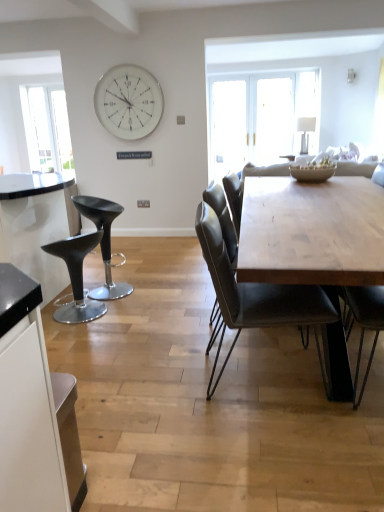
The height and width of the screenshot is (512, 384). What do you see at coordinates (103, 242) in the screenshot? I see `matte black stool at left, arranged as the first stool when viewed from the back` at bounding box center [103, 242].

Identify the location of leather seat at center. This screenshot has height=512, width=384. (254, 296).

Describe the element at coordinates (254, 296) in the screenshot. I see `leather seat at center` at that location.

In order to click on porcelain textured bowl at center in this screenshot , I will do `click(312, 173)`.

Describe the element at coordinates (46, 128) in the screenshot. I see `transparent glass window at left` at that location.

What do you see at coordinates (128, 101) in the screenshot? This screenshot has height=512, width=384. I see `white metallic clock at upper center` at bounding box center [128, 101].

Find the location of a particular element. The height and width of the screenshot is (512, 384). black leather stool at left, the 2th stool when ordered from back to front is located at coordinates (77, 277).

The height and width of the screenshot is (512, 384). I want to click on bowl above the leather seat at center (from a real-world perspective), so click(x=312, y=173).

Looking at this image, considering the sizes of objects porcelain textured bowl at center and leather seat at center in the image provided, who is taller, porcelain textured bowl at center or leather seat at center?

leather seat at center.

Can you tell me how much porcelain textured bowl at center and leather seat at center differ in facing direction?

95.2 degrees separate the facing orientations of porcelain textured bowl at center and leather seat at center.

Is leather seat at center located within porcelain textured bowl at center?

Actually, leather seat at center is outside porcelain textured bowl at center.

Does matte black stool at left, arranged as the first stool when viewed from the back, have a larger size compared to porcelain textured bowl at center?

Yes.

Is matte black stool at left, arranged as the first stool when viewed from the back, not close to porcelain textured bowl at center?

matte black stool at left, arranged as the first stool when viewed from the back, is positioned a significant distance from porcelain textured bowl at center.

Considering the points (96, 227) and (318, 173), which point is behind, point (96, 227) or point (318, 173)?

Positioned behind is point (318, 173).

What's the angular difference between leather seat at center and white metallic clock at upper center's facing directions?

leather seat at center and white metallic clock at upper center are facing 93.2 degrees away from each other.

From a real-world perspective, which object stands above the other?

In real-world perspective, white metallic clock at upper center is above.

Does leather seat at center turn towards white metallic clock at upper center?

No, leather seat at center is not aimed at white metallic clock at upper center.

Considering the sizes of leather seat at center and white metallic clock at upper center in the image, is leather seat at center taller or shorter than white metallic clock at upper center?

leather seat at center is taller than white metallic clock at upper center.

Can we say porcelain textured bowl at center lies outside transparent glass window at left?

That's correct, porcelain textured bowl at center is outside of transparent glass window at left.

Could you tell me if porcelain textured bowl at center is facing transparent glass window at left?

No, porcelain textured bowl at center is not oriented towards transparent glass window at left.

From the image's perspective, which one is positioned higher, porcelain textured bowl at center or transparent glass window at left?

transparent glass window at left is shown above in the image.

Is point (313, 169) positioned behind point (67, 141)?

No, it is not.

Can you confirm if matte black stool at left, which is counted as the 2th stool, starting from the front, is taller than black leather stool at left, the 2th stool when ordered from back to front?

Yes, matte black stool at left, which is counted as the 2th stool, starting from the front, is taller than black leather stool at left, the 2th stool when ordered from back to front.

Are matte black stool at left, arranged as the first stool when viewed from the back, and black leather stool at left, the 2th stool when ordered from back to front, located far from each other?

No, matte black stool at left, arranged as the first stool when viewed from the back, is not far away from black leather stool at left, the 2th stool when ordered from back to front.

Would you say matte black stool at left, which is counted as the 2th stool, starting from the front, is inside or outside black leather stool at left, positioned as the 1th stool in front-to-back order?

matte black stool at left, which is counted as the 2th stool, starting from the front, is spatially situated outside black leather stool at left, positioned as the 1th stool in front-to-back order.

From a real-world perspective, which object stands above the other?

matte black stool at left, arranged as the first stool when viewed from the back.

Considering the relative positions of leather seat at center and white glossy lampshade at upper center in the image provided, is leather seat at center to the left of white glossy lampshade at upper center from the viewer's perspective?

Yes.

Does leather seat at center lie behind white glossy lampshade at upper center?

No.

Where is `chair below the white glossy lampshade at upper center (from a real-world perspective)`? Image resolution: width=384 pixels, height=512 pixels. chair below the white glossy lampshade at upper center (from a real-world perspective) is located at coordinates (254, 296).

Can you tell me how much leather seat at center and white glossy lampshade at upper center differ in facing direction?

leather seat at center and white glossy lampshade at upper center are facing 180 degrees away from each other.

Are black leather stool at left, positioned as the 1th stool in front-to-back order, and white metallic clock at upper center beside each other?

No, black leather stool at left, positioned as the 1th stool in front-to-back order, is not next to white metallic clock at upper center.

Is white metallic clock at upper center inside black leather stool at left, the 2th stool when ordered from back to front?

Actually, white metallic clock at upper center is outside black leather stool at left, the 2th stool when ordered from back to front.

Is point (60, 241) closer or farther from the camera than point (151, 90)?

Point (60, 241) is positioned closer to the camera compared to point (151, 90).

How different are the orientations of black leather stool at left, positioned as the 1th stool in front-to-back order, and white metallic clock at upper center in degrees?

134 degrees.

Where is `chair below the porcelain textured bowl at center (from a real-world perspective)`? chair below the porcelain textured bowl at center (from a real-world perspective) is located at coordinates (254, 296).

From the image's perspective, starting from the porcelain textured bowl at center, which stool is the 1st one below? Please provide its 2D coordinates.

[(103, 242)]

Based on their spatial positions, is matte black stool at left, which is counted as the 2th stool, starting from the front, or leather seat at center closer to black leather stool at left, positioned as the 1th stool in front-to-back order?

Based on the image, matte black stool at left, which is counted as the 2th stool, starting from the front, appears to be nearer to black leather stool at left, positioned as the 1th stool in front-to-back order.

Looking at the image, which one is located further to leather seat at center, white glossy lampshade at upper center or transparent glass window at left?

Among the two, transparent glass window at left is located further to leather seat at center.

From the image, which object appears to be nearer to transparent glass window at left, white metallic clock at upper center or matte black stool at left, arranged as the first stool when viewed from the back?

white metallic clock at upper center lies closer to transparent glass window at left than the other object.

Estimate the real-world distances between objects in this image. Which object is further from white glossy lampshade at upper center, leather seat at center or porcelain textured bowl at center?

The object further to white glossy lampshade at upper center is leather seat at center.

When comparing their distances from transparent glass window at left, does white metallic clock at upper center or white glossy lampshade at upper center seem closer?

white metallic clock at upper center is positioned closer to the anchor transparent glass window at left.

Looking at the image, which one is located closer to matte black stool at left, arranged as the first stool when viewed from the back, white metallic clock at upper center or transparent glass window at left?

Based on the image, white metallic clock at upper center appears to be nearer to matte black stool at left, arranged as the first stool when viewed from the back.

From the image, which object appears to be farther from porcelain textured bowl at center, white metallic clock at upper center or leather seat at center?

The object further to porcelain textured bowl at center is white metallic clock at upper center.

Based on their spatial positions, is black leather stool at left, positioned as the 1th stool in front-to-back order, or transparent glass window at left closer to white metallic clock at upper center?

Based on the image, black leather stool at left, positioned as the 1th stool in front-to-back order, appears to be nearer to white metallic clock at upper center.

I want to click on wall clock between leather seat at center and white glossy lampshade at upper center along the z-axis, so click(x=128, y=101).

Where is `bowl located between matte black stool at left, which is counted as the 2th stool, starting from the front, and transparent glass window at left in the depth direction`? This screenshot has width=384, height=512. bowl located between matte black stool at left, which is counted as the 2th stool, starting from the front, and transparent glass window at left in the depth direction is located at coordinates (312, 173).

The image size is (384, 512). In order to click on bowl between leather seat at center and white metallic clock at upper center along the z-axis in this screenshot , I will do `click(312, 173)`.

Find the location of a particular element. stool between black leather stool at left, the 2th stool when ordered from back to front, and white glossy lampshade at upper center in the front-back direction is located at coordinates (103, 242).